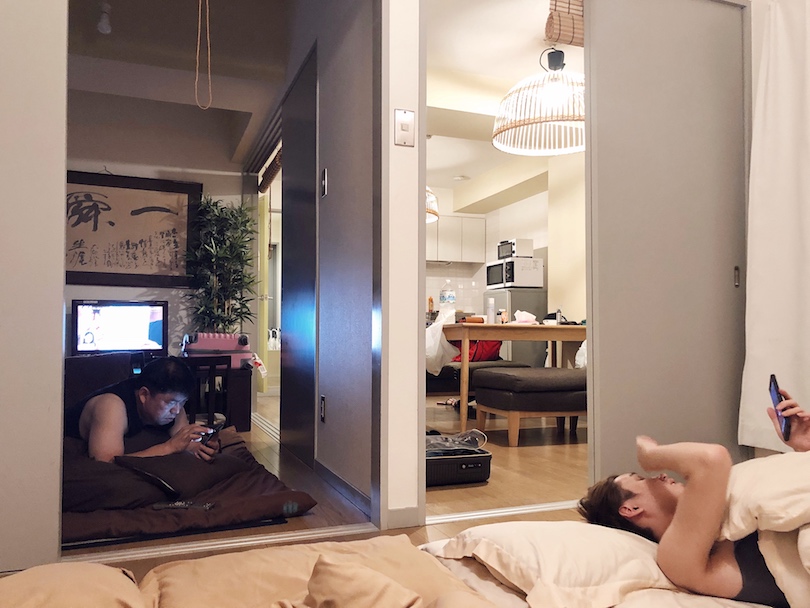
Where is `floor`? floor is located at coordinates (523, 477).